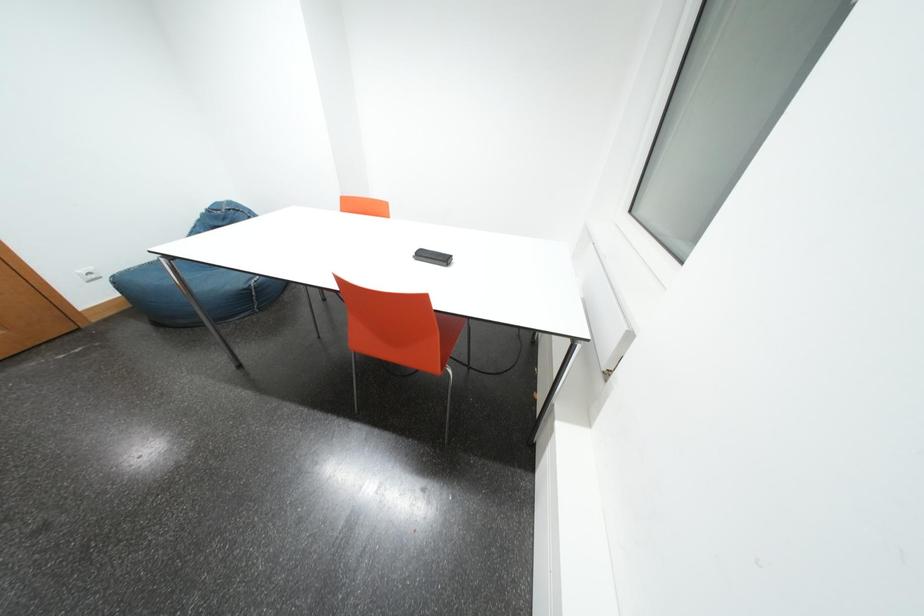
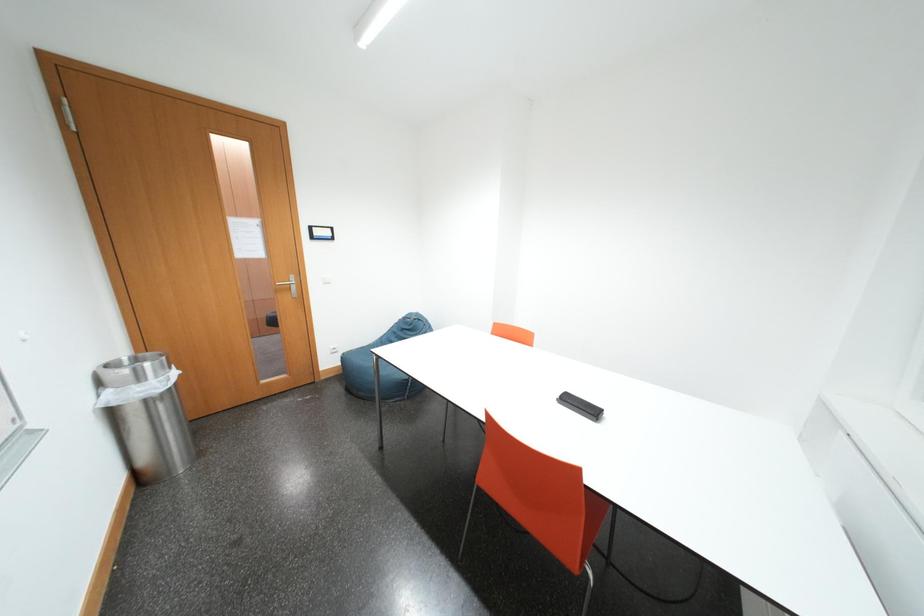
The images are taken continuously from a first-person perspective. In which direction is your viewpoint rotating?

The camera's rotation is toward left-up.